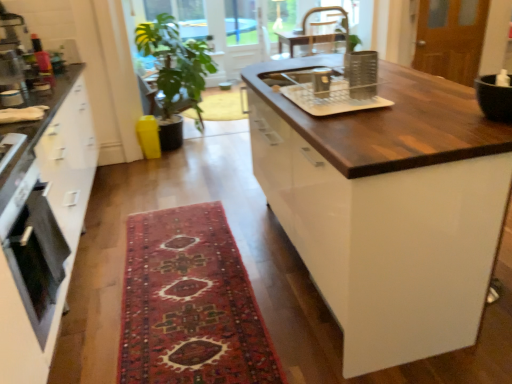
I want to click on vacant point to the left of dark wood countertop at center, so click(x=192, y=272).